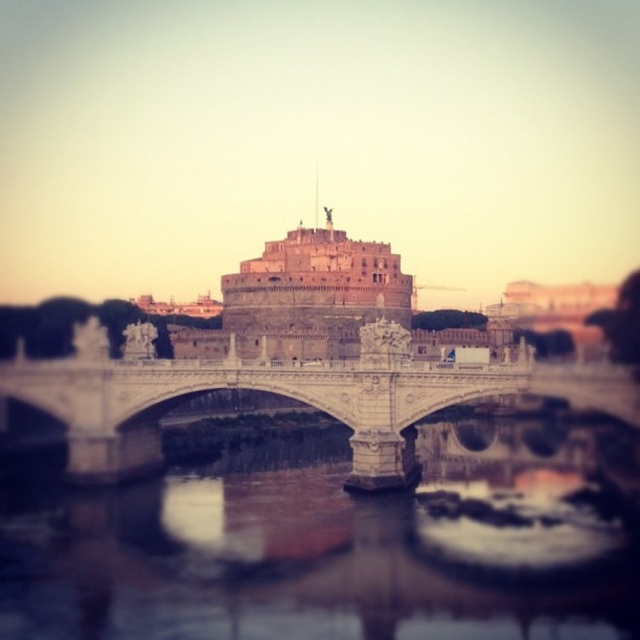
You are a tourist standing on the bank of the river and want to take a photo of the white stone bridge at center and the brown reflective water at center. If your camera can only focus on objects within 10 meters, will both objects be in focus?

The brown reflective water at center is 9.37 meters away from white stone bridge at center. Since the distance between them is less than 10 meters, both objects will be within the camera focus range and in focus.

You are standing at the camera position and want to throw a small pebble into the brown reflective water at center. Considering the distance between you and the water, will the pebble reach the water if you throw it with a typical human throwing distance of 100 feet?

The distance between you and the brown reflective water at center is 146.61 feet, which is farther than the typical human throwing distance of 100 feet. Therefore, the pebble will not reach the water.

You are a tourist standing on the white stone bridge at center and want to take a photo of the brown reflective water at center. Can you see the water below the bridge in your shot?

The brown reflective water at center is below the white stone bridge at center, so yes, you can see the water below the bridge in your photo.